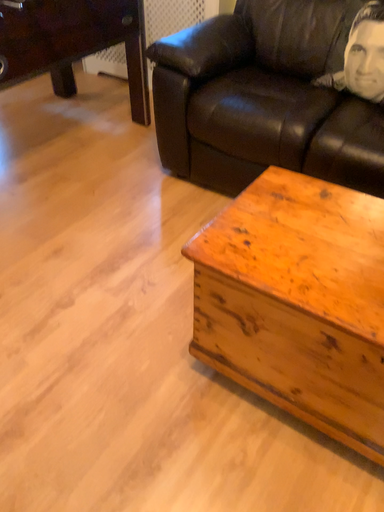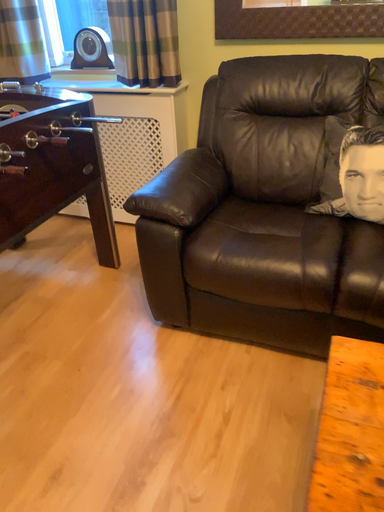
Question: How did the camera likely rotate when shooting the video?

Choices:
 (A) rotated left
 (B) rotated right

Answer: (B)